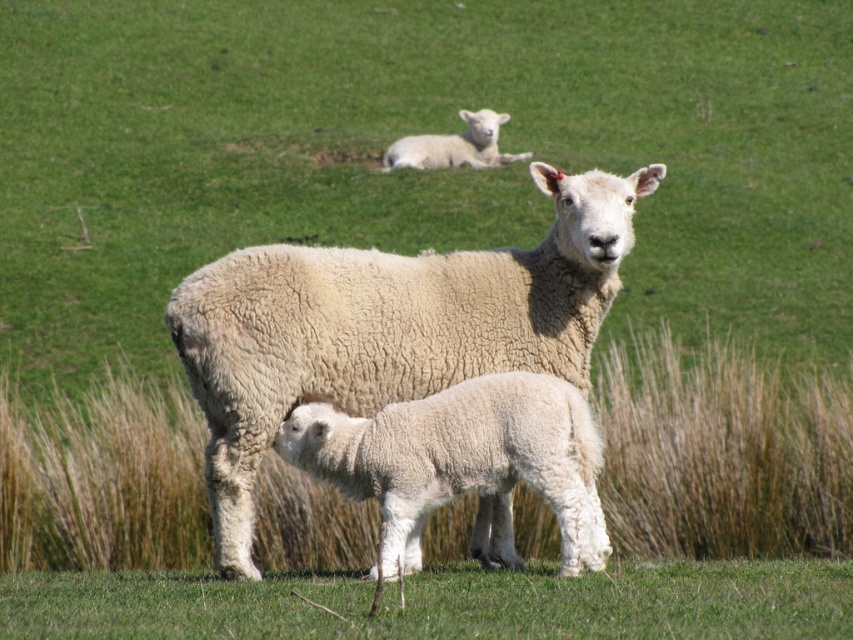
Question: Where is white woolen lamb at center located in relation to white woolen lamb at upper center in the image?

Choices:
 (A) left
 (B) right

Answer: (B)

Question: Which object is the closest to the white woolen lamb at upper center?

Choices:
 (A) green soft grass at lower center
 (B) white woolen sheep at center
 (C) white woolen lamb at center

Answer: (A)

Question: Which of the following is the closest to the observer?

Choices:
 (A) white woolen sheep at center
 (B) green soft grass at lower center
 (C) white woolen lamb at center
 (D) white woolen lamb at upper center

Answer: (B)

Question: Which of these objects is positioned farthest from the green soft grass at lower center?

Choices:
 (A) white woolen sheep at center
 (B) white woolen lamb at center
 (C) white woolen lamb at upper center

Answer: (C)

Question: Is green soft grass at lower center above white woolen lamb at upper center?

Choices:
 (A) yes
 (B) no

Answer: (B)

Question: Is white woolen sheep at center bigger than white woolen lamb at upper center?

Choices:
 (A) yes
 (B) no

Answer: (A)